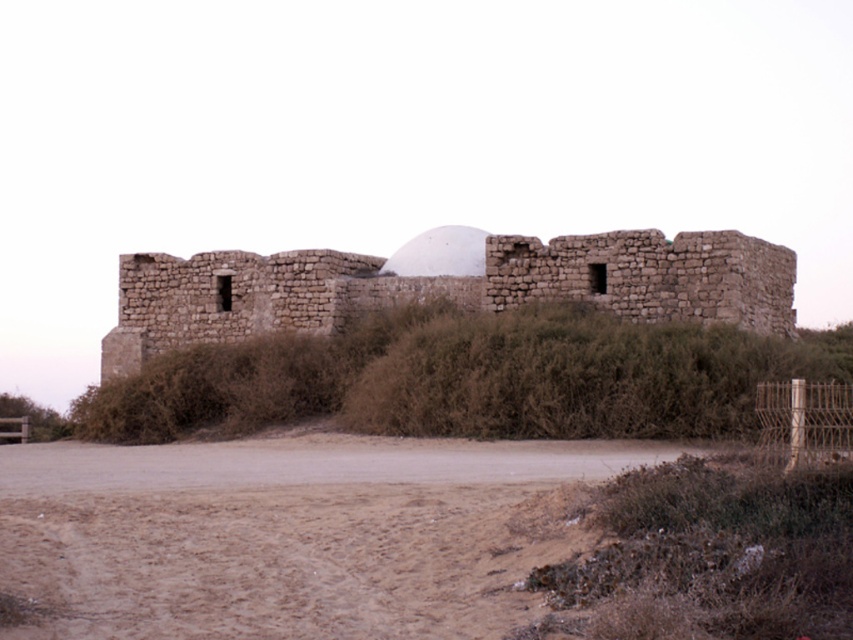
Is brown sandy dirt field at lower left shorter than brown stone ruins at center?

Indeed, brown sandy dirt field at lower left has a lesser height compared to brown stone ruins at center.

This screenshot has height=640, width=853. Find the location of `brown sandy dirt field at lower left`. brown sandy dirt field at lower left is located at coordinates (294, 532).

This screenshot has width=853, height=640. Find the location of `brown sandy dirt field at lower left`. brown sandy dirt field at lower left is located at coordinates (294, 532).